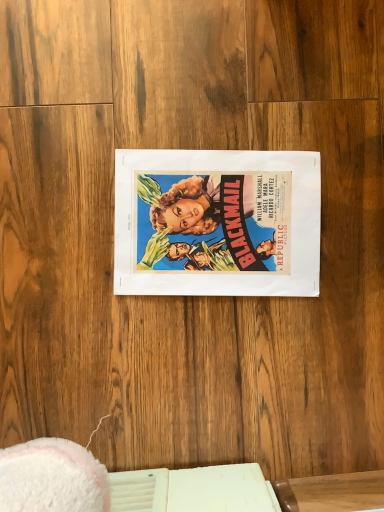
Question: Based on their positions, is wooden table at center located to the left or right of vibrant paper poster at center?

Choices:
 (A) left
 (B) right

Answer: (B)

Question: Looking at their shapes, would you say wooden table at center is wider or thinner than vibrant paper poster at center?

Choices:
 (A) wide
 (B) thin

Answer: (B)

Question: From a real-world perspective, is wooden table at center positioned above or below vibrant paper poster at center?

Choices:
 (A) below
 (B) above

Answer: (B)

Question: Choose the correct answer: Is vibrant paper poster at center inside wooden table at center or outside it?

Choices:
 (A) outside
 (B) inside

Answer: (A)

Question: In terms of width, does vibrant paper poster at center look wider or thinner when compared to wooden table at center?

Choices:
 (A) thin
 (B) wide

Answer: (B)

Question: In terms of height, does vibrant paper poster at center look taller or shorter compared to wooden table at center?

Choices:
 (A) short
 (B) tall

Answer: (A)

Question: Is vibrant paper poster at center in front of or behind wooden table at center in the image?

Choices:
 (A) front
 (B) behind

Answer: (B)